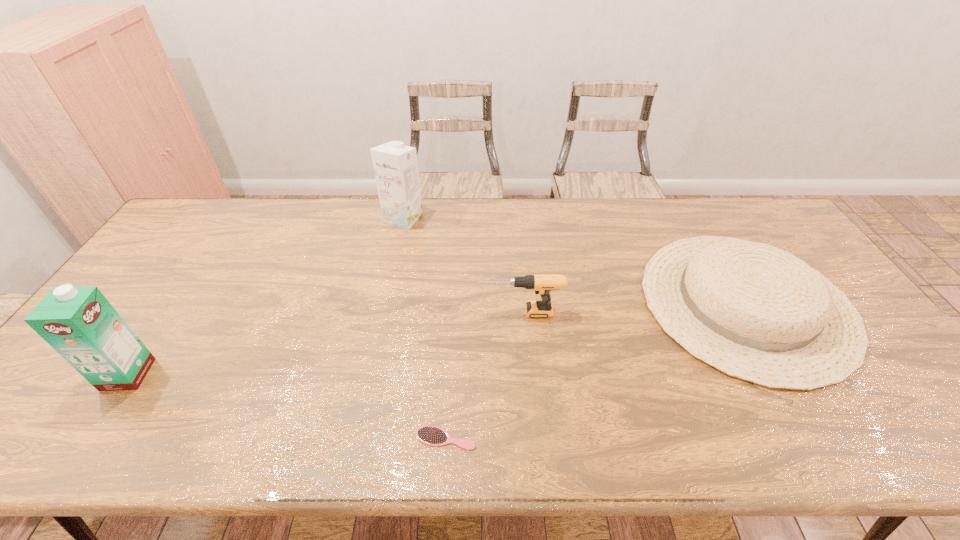
The width and height of the screenshot is (960, 540). What are the coordinates of `blank region between the farther carton and the rightmost object` in the screenshot? It's located at (575, 261).

Image resolution: width=960 pixels, height=540 pixels. I want to click on blank region between the rightmost object and the nearest object, so click(x=596, y=370).

Where is `free spot between the third object from right to left and the third shortest object`? This screenshot has width=960, height=540. free spot between the third object from right to left and the third shortest object is located at coordinates (483, 375).

Image resolution: width=960 pixels, height=540 pixels. In order to click on unoccupied position between the leftmost object and the rightmost object in this screenshot , I will do `click(437, 339)`.

Locate an element on the screen. The image size is (960, 540). unoccupied area between the second object from right to left and the leftmost object is located at coordinates (324, 343).

Identify the location of empty space that is in between the nearest object and the left carton. (287, 406).

Where is `blank region between the hairbrush and the fourth object from right to left`? The width and height of the screenshot is (960, 540). blank region between the hairbrush and the fourth object from right to left is located at coordinates (424, 328).

Find the location of a particular element. Image resolution: width=960 pixels, height=540 pixels. vacant point located between the farthest object and the third object from left to right is located at coordinates (424, 328).

Identify the location of free area in between the fourth tallest object and the farthest object. (575, 261).

Identify which object is the third closest to the third tallest object. Please provide its 2D coordinates. Your answer should be formatted as a tuple, i.e. [(x, y)], where the tuple contains the x and y coordinates of a point satisfying the conditions above.

[(395, 165)]